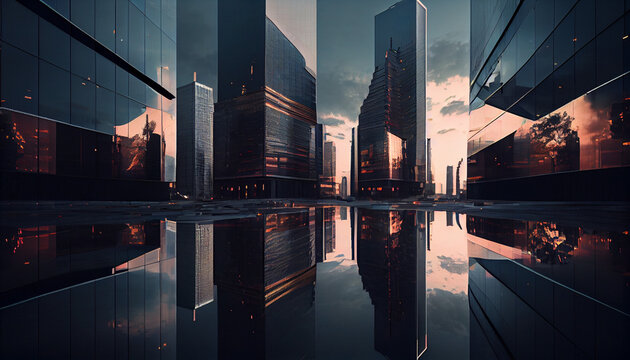
Where is `reflective floor/ground area`? The width and height of the screenshot is (630, 360). reflective floor/ground area is located at coordinates (235, 278).